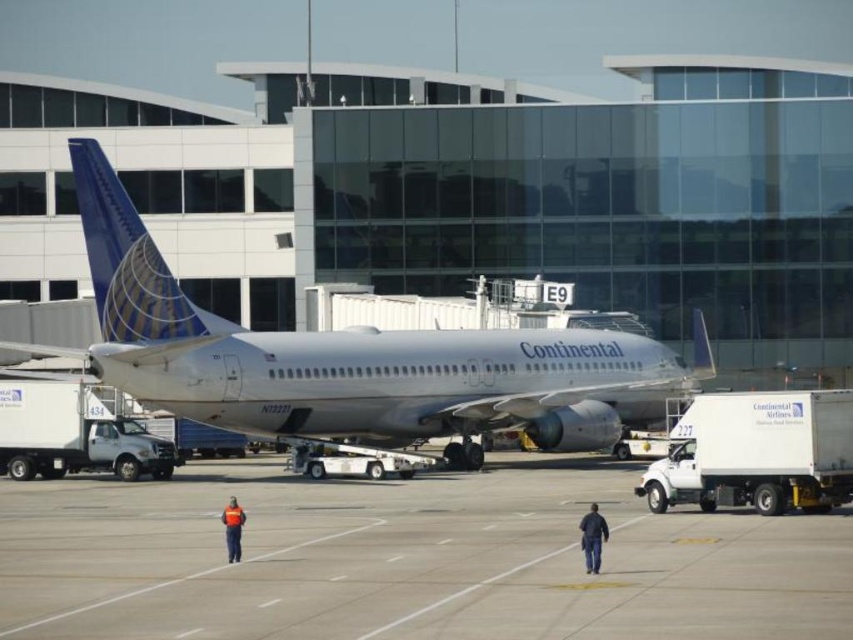
Who is positioned more to the right, white metallic airplane at center or dark blue jeans at lower center?

dark blue jeans at lower center is more to the right.

Which is below, white metallic airplane at center or dark blue jeans at lower center?

dark blue jeans at lower center is below.

In order to click on white metallic airplane at center in this screenshot , I will do `click(350, 358)`.

Does gray concrete tarmac at center have a greater width compared to dark blue jeans at lower center?

Correct, the width of gray concrete tarmac at center exceeds that of dark blue jeans at lower center.

Between gray concrete tarmac at center and dark blue jeans at lower center, which one has less height?

gray concrete tarmac at center is shorter.

What do you see at coordinates (408, 560) in the screenshot? I see `gray concrete tarmac at center` at bounding box center [408, 560].

At what (x,y) coordinates should I click in order to perform the action: click on gray concrete tarmac at center. Please return your answer as a coordinate pair (x, y). Image resolution: width=853 pixels, height=640 pixels. Looking at the image, I should click on (408, 560).

Which is more to the right, gray concrete tarmac at center or orange reflective vest at center?

Positioned to the right is gray concrete tarmac at center.

Identify the location of gray concrete tarmac at center. click(x=408, y=560).